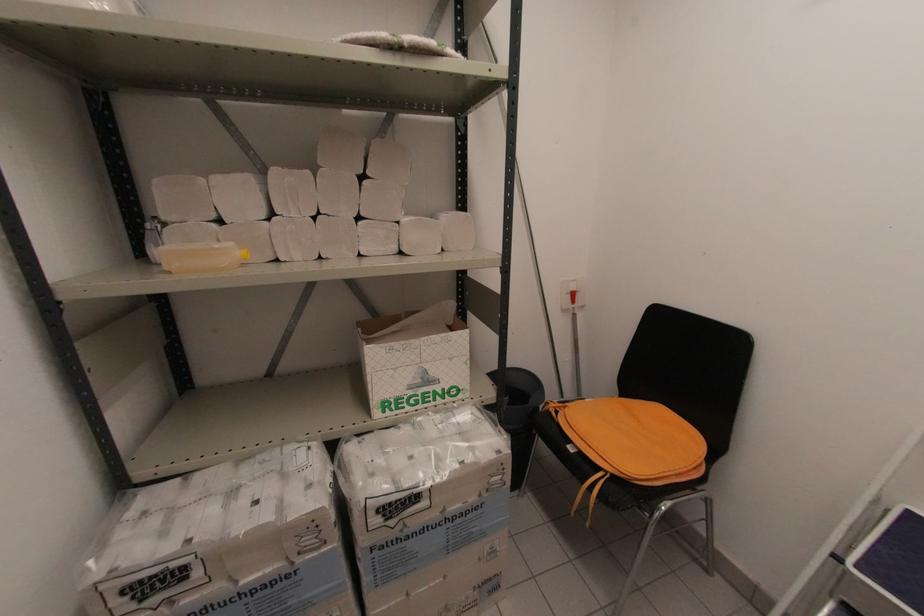
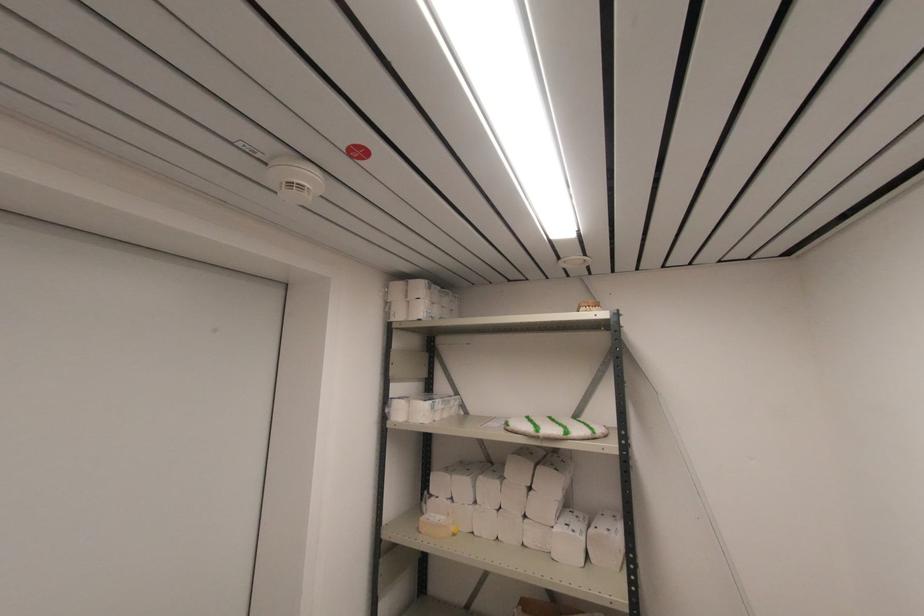
In the second image, find the point that corresponds to point 396,41 in the first image.

(537, 436)